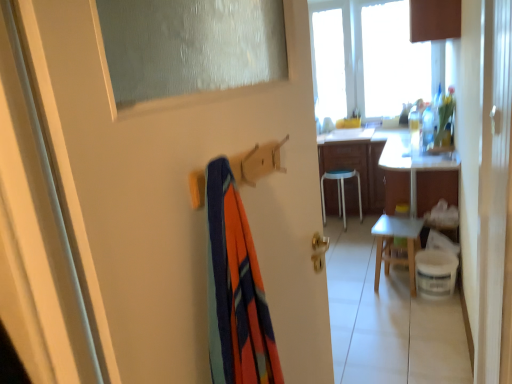
Describe the element at coordinates (413, 162) in the screenshot. The width and height of the screenshot is (512, 384). I see `white glossy desk at right` at that location.

I want to click on white glossy desk at right, so click(413, 162).

The image size is (512, 384). What do you see at coordinates (392, 244) in the screenshot? I see `wooden chair at center` at bounding box center [392, 244].

This screenshot has width=512, height=384. I want to click on wooden chair at center, so click(x=392, y=244).

This screenshot has height=384, width=512. I want to click on white glossy desk at right, so click(x=413, y=162).

Can you confirm if white glossy desk at right is positioned to the left of wooden chair at center?

No, white glossy desk at right is not to the left of wooden chair at center.

Which object is closer to the camera, white glossy desk at right or wooden chair at center?

wooden chair at center is closer to the camera.

Between point (411, 183) and point (389, 251), which one is positioned behind?

The point (389, 251) is more distant.

Looking at this image, from the image's perspective, which is above, white glossy desk at right or wooden chair at center?

From the image's view, white glossy desk at right is above.

From a real-world perspective, does white glossy desk at right sit lower than wooden chair at center?

Actually, white glossy desk at right is physically above wooden chair at center in the real world.

Considering the relative sizes of white glossy desk at right and wooden chair at center in the image provided, is white glossy desk at right wider than wooden chair at center?

Correct, the width of white glossy desk at right exceeds that of wooden chair at center.

From their relative heights in the image, would you say white glossy desk at right is taller or shorter than wooden chair at center?

In the image, white glossy desk at right appears to be taller than wooden chair at center.

Considering the relative sizes of white glossy desk at right and wooden chair at center in the image provided, is white glossy desk at right bigger than wooden chair at center?

Yes, white glossy desk at right is bigger than wooden chair at center.

Choose the correct answer: Is white glossy desk at right inside wooden chair at center or outside it?

white glossy desk at right cannot be found inside wooden chair at center.

Is white glossy desk at right not close to wooden chair at center?

A: No, white glossy desk at right is in close proximity to wooden chair at center.

Does white glossy desk at right turn towards wooden chair at center?

No, white glossy desk at right does not turn towards wooden chair at center.

Can you tell me how much white glossy desk at right and wooden chair at center differ in facing direction?

The angular difference between white glossy desk at right and wooden chair at center is 79.9 degrees.

Measure the distance from white glossy desk at right to wooden chair at center.

white glossy desk at right and wooden chair at center are 15.99 inches apart.

Where is `desk that appears behind the wooden chair at center`? desk that appears behind the wooden chair at center is located at coordinates (413, 162).

Can you confirm if wooden chair at center is positioned to the right of white glossy desk at right?

No, wooden chair at center is not to the right of white glossy desk at right.

Relative to white glossy desk at right, is wooden chair at center in front or behind?

Visually, wooden chair at center is located in front of white glossy desk at right.

Is point (387, 237) positioned behind point (424, 162)?

No.

From the image's perspective, is wooden chair at center above or below white glossy desk at right?

wooden chair at center is situated lower than white glossy desk at right in the image.

From a real-world perspective, is wooden chair at center located higher than white glossy desk at right?

Actually, wooden chair at center is physically below white glossy desk at right in the real world.

Is wooden chair at center thinner than white glossy desk at right?

Correct, the width of wooden chair at center is less than that of white glossy desk at right.

Considering the relative sizes of wooden chair at center and white glossy desk at right in the image provided, is wooden chair at center taller than white glossy desk at right?

In fact, wooden chair at center may be shorter than white glossy desk at right.

Does wooden chair at center have a smaller size compared to white glossy desk at right?

Yes.

Can white glossy desk at right be found inside wooden chair at center?

Definitely not — white glossy desk at right is not inside wooden chair at center.

Is wooden chair at center not close to white glossy desk at right?

No, wooden chair at center is not far away from white glossy desk at right.

Is wooden chair at center facing towards white glossy desk at right?

No, wooden chair at center does not turn towards white glossy desk at right.

Can you tell me how much wooden chair at center and white glossy desk at right differ in facing direction?

The facing directions of wooden chair at center and white glossy desk at right are 79.9 degrees apart.

This screenshot has height=384, width=512. I want to click on chair to the left of white glossy desk at right, so click(392, 244).

This screenshot has width=512, height=384. What are the coordinates of `desk lying above the wooden chair at center (from the image's perspective)` in the screenshot? It's located at (413, 162).

The width and height of the screenshot is (512, 384). What are the coordinates of `chair on the left side of white glossy desk at right` in the screenshot? It's located at (392, 244).